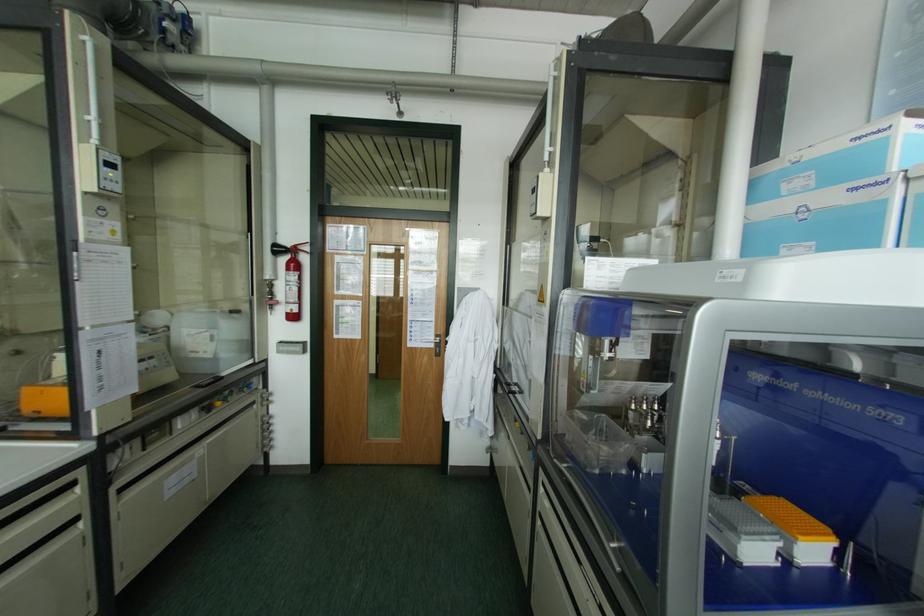
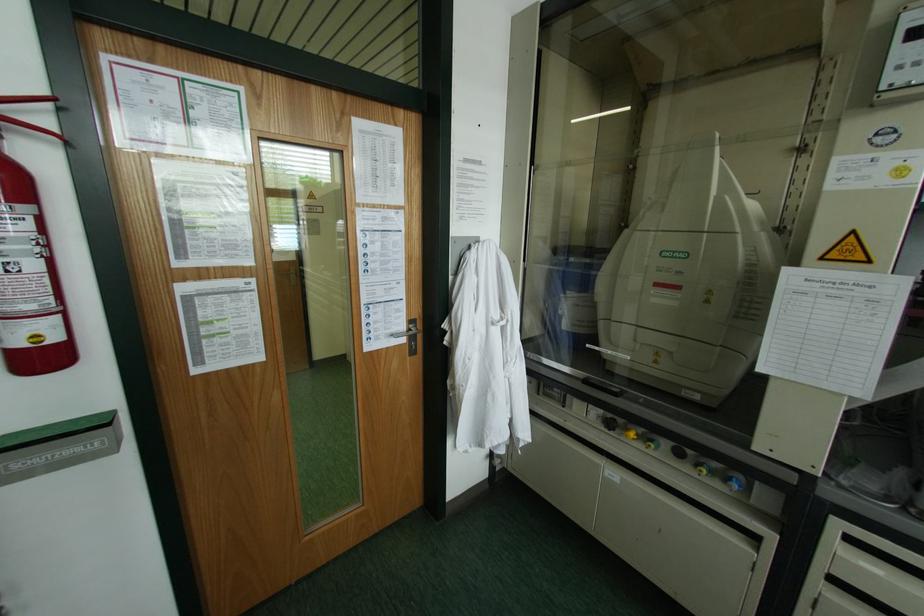
Find the pixel in the second image that matches [435,334] in the first image.

(409, 321)